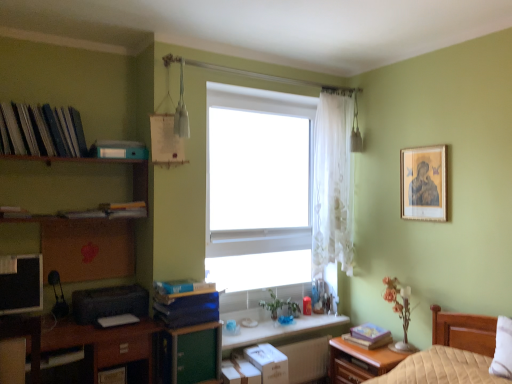
Question: Based on their positions, is blue matte book at lower left, which appears as the second book when viewed from the right, located to the left or right of hardcover book at center, the 5th book when ordered from top to bottom?

Choices:
 (A) right
 (B) left

Answer: (B)

Question: Is blue matte book at lower left, marked as the third book in a bottom-to-top arrangement, wider or thinner than hardcover book at center, which is the first book in right-to-left order?

Choices:
 (A) wide
 (B) thin

Answer: (B)

Question: Estimate the real-world distances between objects in this image. Which object is closer to the green matte file cabinet at lower left?

Choices:
 (A) hardcover book at center, the 5th book when ordered from top to bottom
 (B) translucent glass vase at window
 (C) matte cardboard books at left, acting as the 5th book starting from the bottom
 (D) brown wooden desk at lower left
 (E) white matte window at center

Answer: (D)

Question: Which of these objects is positioned closest to the white matte window at center?

Choices:
 (A) blue matte book at lower left, which appears as the second book when ordered from the bottom
 (B) matte cardboard books at left, which is the first book from top to bottom
 (C) black plastic printer at lower left
 (D) wooden nightstand at lower right
 (E) matte blue bookshelf at upper left, the fourth book from the bottom

Answer: (A)